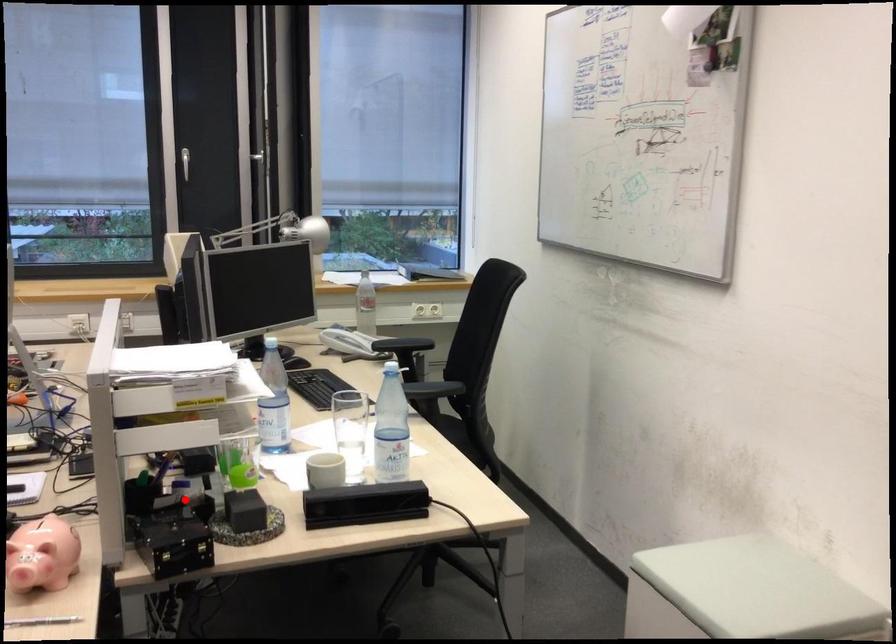
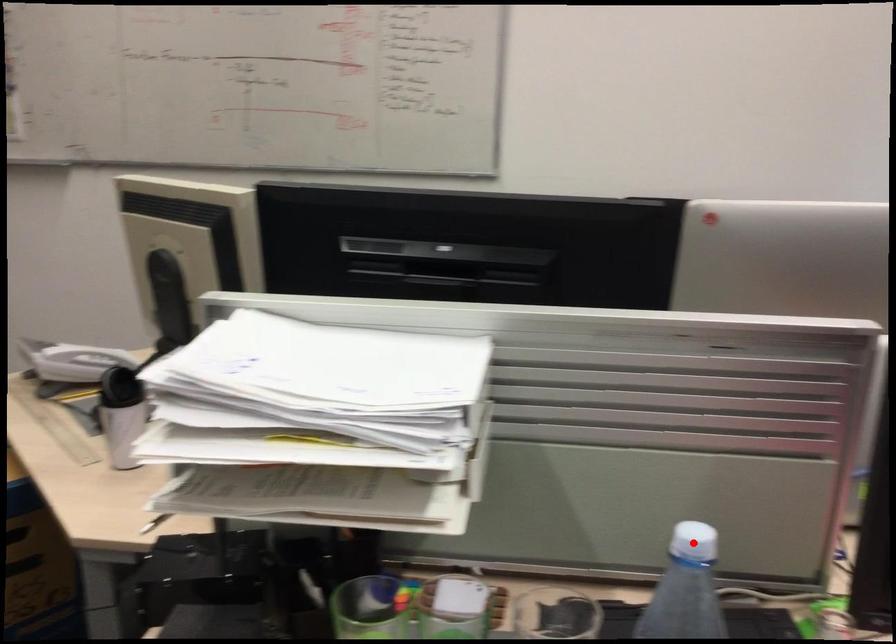
I am providing you with two images of the same scene from different viewpoints. A red point is marked on the first image and another point is marked on the second image. Are the points marked in image1 and image2 representing the same 3D position?

No